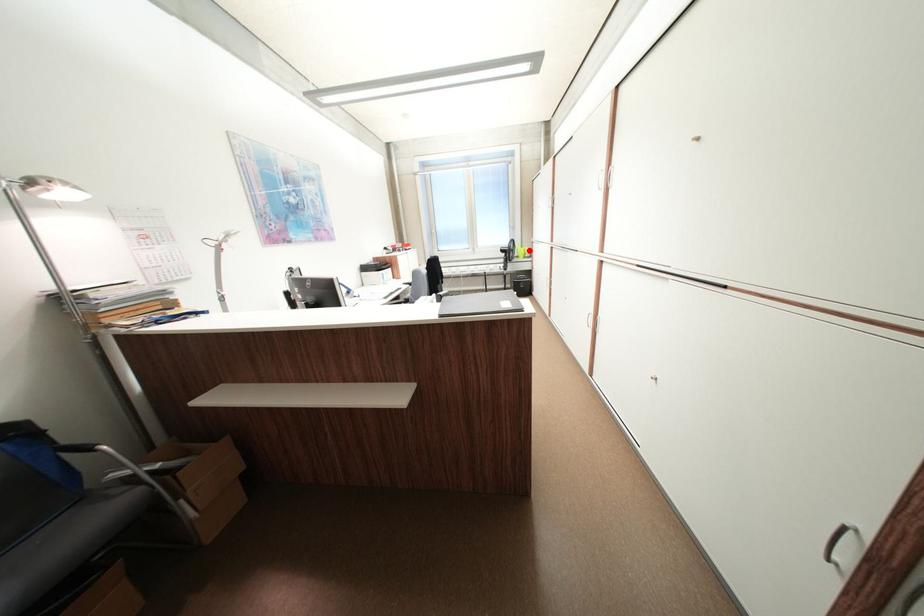
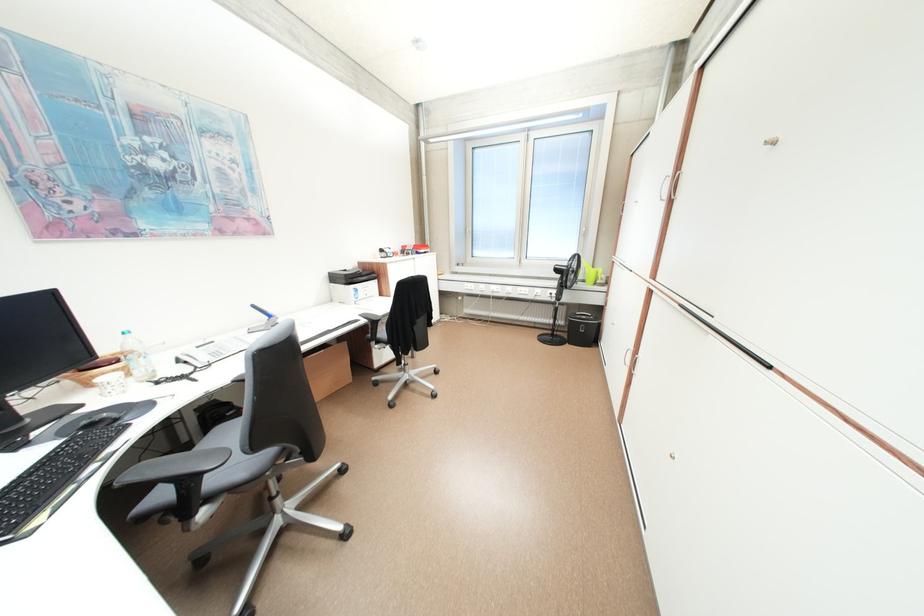
Question: I am providing you with two images of the same scene from different viewpoints. In image1, a red point is highlighted. Considering the same 3D point in image2, which of the following is correct?

Choices:
 (A) It is closer
 (B) It is farther

Answer: (B)